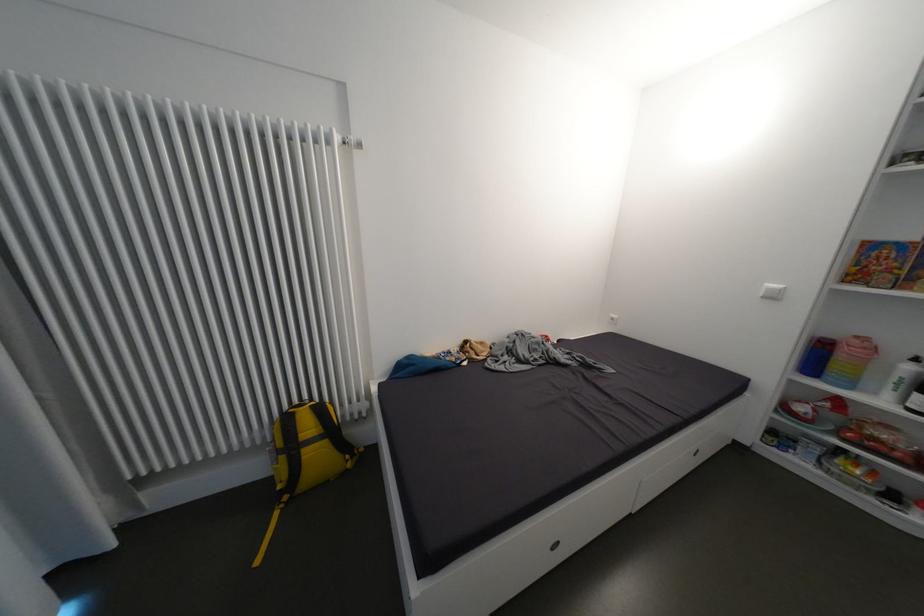
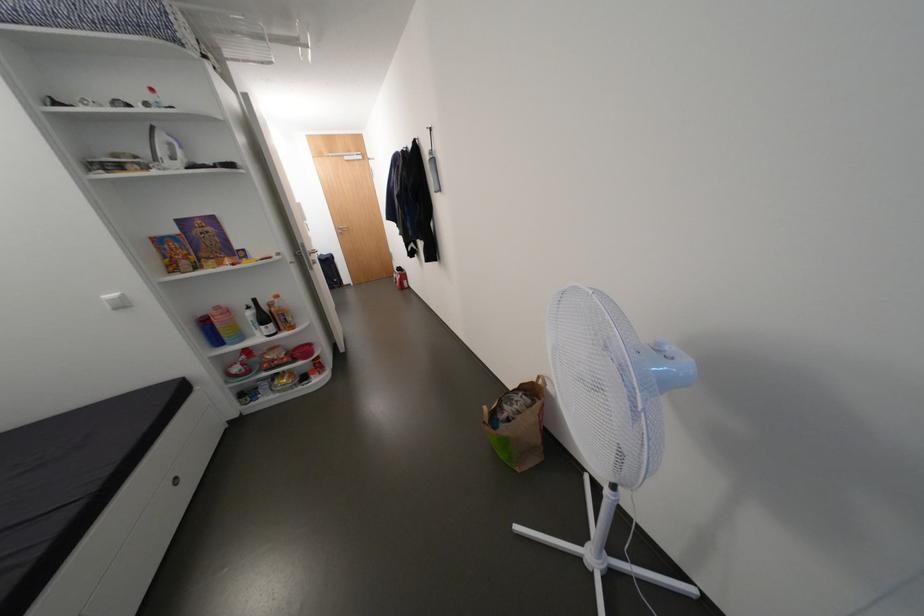
Locate, in the second image, the point that corresponds to [785,286] in the first image.

(120, 296)